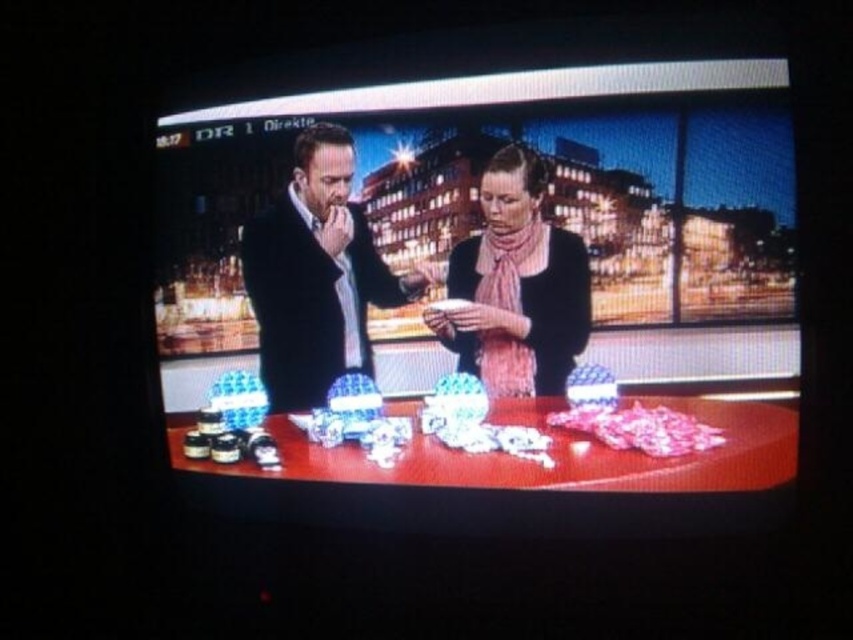
You are a guest on a TV show and you see the shiny plastic table at center and the pink striped scarf at center. Which object is closer to the camera?

The pink striped scarf at center is closer to the camera because the shiny plastic table at center is below it, indicating it is further away.

You are standing at the point marked by the coordinates point [627,104]. You want to walk to the door located at the opposite side of the room. The host tells you that the shortest path is 4.47 feet. Can you reach the door without crossing the table?

The distance between you and the door is 4.47 feet, which matches the shortest path mentioned. However, since the table is in the foreground between your starting point and the door, you would need to navigate around it. The provided distance does not account for obstacles, so you might need to adjust your path to avoid the table and still reach the door.